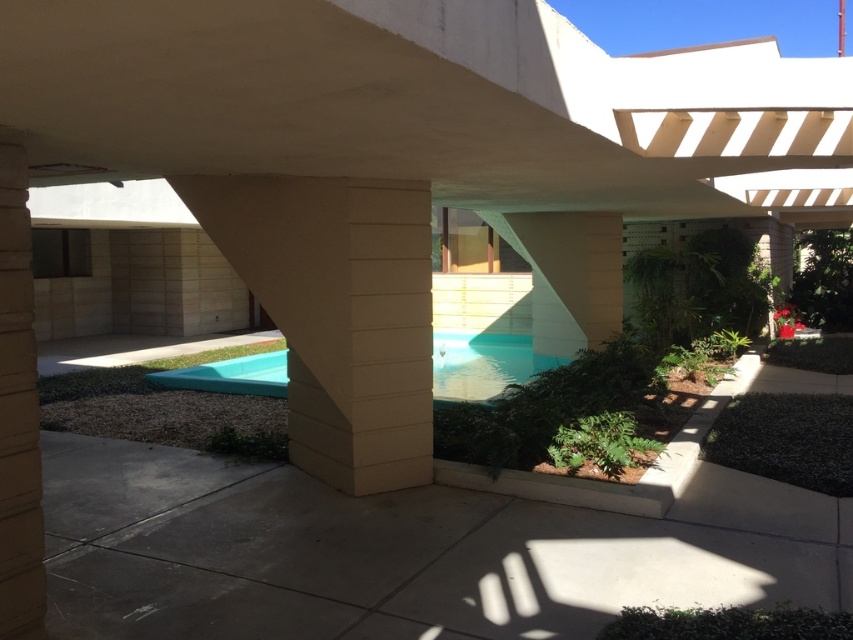
You are standing at the concrete overhang and looking towards the pool. There are two points marked in the scene, point (x=323, y=296) and point (x=494, y=339). Which point is closer to you?

Point (x=323, y=296) is in front of point (x=494, y=339), so it is closer to you.

You are designing a new outdoor space and want to ensure that the pillars and pools are proportionate. Given the beige textured pillar at center and the light blue smooth pool at center, which one has a larger width?

The light blue smooth pool at center has a larger width than the beige textured pillar at center.